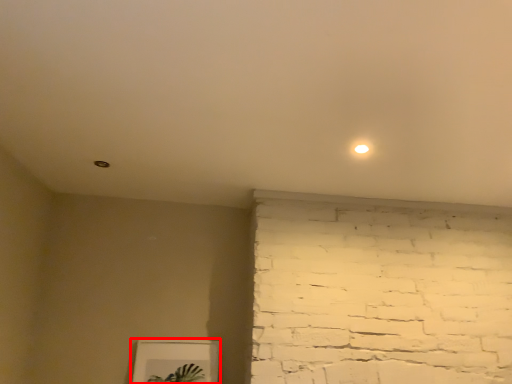
Question: Considering the relative positions of picture frame (annotated by the red box) and light in the image provided, where is picture frame (annotated by the red box) located with respect to the staircase?

Choices:
 (A) left
 (B) right

Answer: (A)